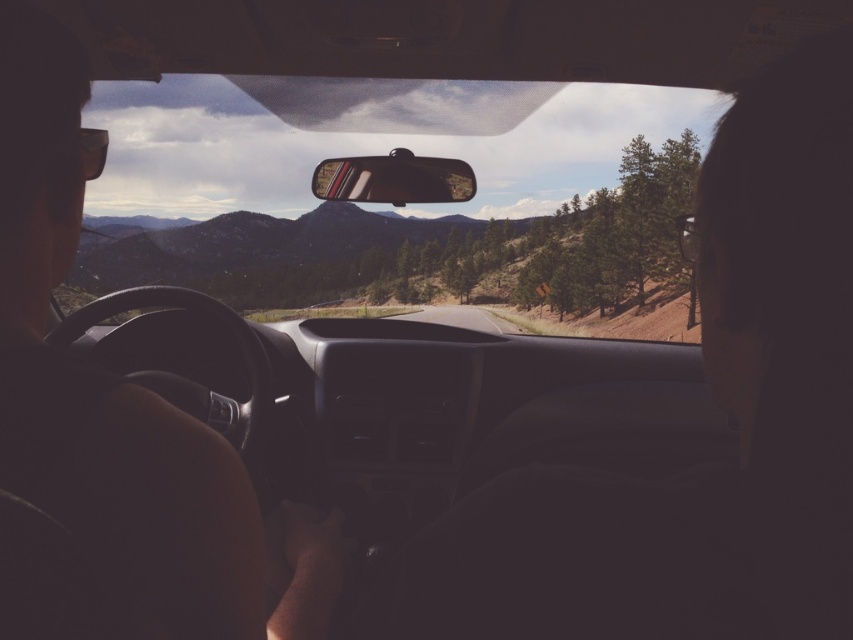
Question: Which of the following is the farthest from the observer?

Choices:
 (A) (315, 609)
 (B) (335, 192)
 (C) (109, 150)

Answer: (C)

Question: Which point is farther to the camera?

Choices:
 (A) (428, 176)
 (B) (555, 115)
 (C) (248, 625)

Answer: (B)

Question: Does matte black steering wheel at left have a greater width compared to matte plastic view mirror at center?

Choices:
 (A) yes
 (B) no

Answer: (B)

Question: Does transparent glass windshield at center have a lesser width compared to matte plastic view mirror at center?

Choices:
 (A) no
 (B) yes

Answer: (A)

Question: Is the position of transparent glass windshield at center less distant than that of matte plastic view mirror at center?

Choices:
 (A) yes
 (B) no

Answer: (B)

Question: Considering the real-world distances, which object is closest to the transparent glass windshield at center?

Choices:
 (A) matte plastic view mirror at center
 (B) matte black steering wheel at left

Answer: (B)